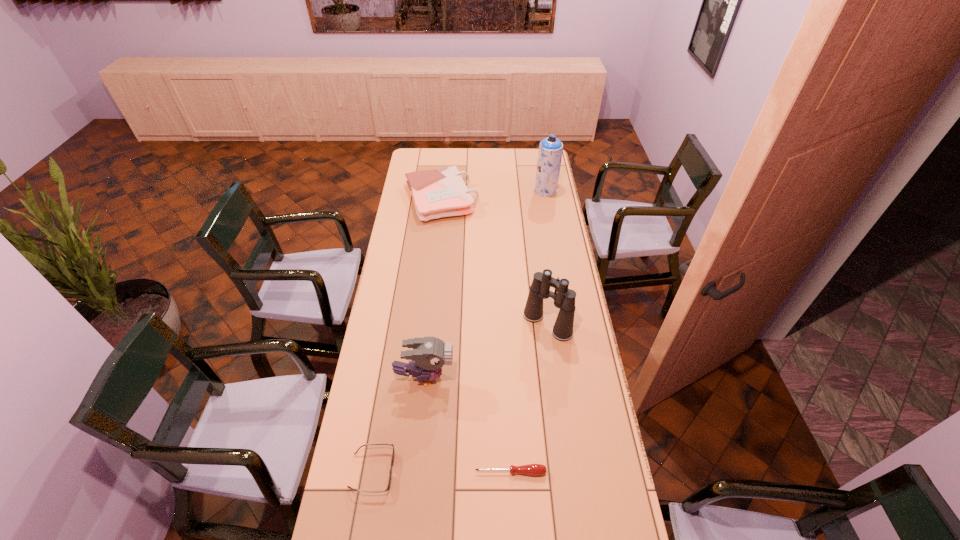
At what (x,y) coordinates should I click in order to perform the action: click on free space located at the beak of the bird. Please return your answer as a coordinate pair (x, y). Looking at the image, I should click on (479, 377).

At what (x,y) coordinates should I click in order to perform the action: click on free space located 0.170m on the right of the phonebook. Please return your answer as a coordinate pair (x, y). This screenshot has height=540, width=960. Looking at the image, I should click on (511, 199).

Locate an element on the screen. The image size is (960, 540). blank area located 0.130m on the front-facing side of the sunglasses is located at coordinates (436, 471).

Identify the location of vacant region located 0.180m on the right of the screwdriver. This screenshot has width=960, height=540. (605, 472).

Where is `bird positioned at the left edge`? bird positioned at the left edge is located at coordinates [x=429, y=354].

Find the location of a particular element. phonebook situated at the left edge is located at coordinates (437, 193).

At what (x,y) coordinates should I click in order to perform the action: click on sunglasses located at the left edge. Please return your answer as a coordinate pair (x, y). This screenshot has height=540, width=960. Looking at the image, I should click on (390, 473).

Locate an element on the screen. The width and height of the screenshot is (960, 540). aerosol can located at the right edge is located at coordinates (550, 151).

The height and width of the screenshot is (540, 960). I want to click on binoculars at the right edge, so click(564, 298).

Where is `free space at the far edge of the desktop`? free space at the far edge of the desktop is located at coordinates (466, 166).